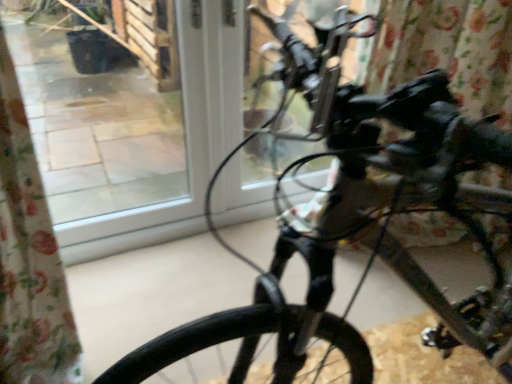
Identify the location of free space in front of transparent glass window at center. (139, 286).